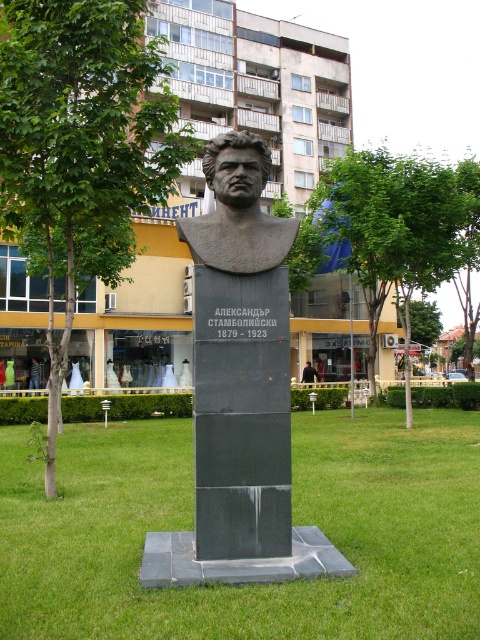
Question: In this image, where is green leafy tree at center located relative to matte black bust at center?

Choices:
 (A) left
 (B) right

Answer: (B)

Question: Which point is farther to the camera?

Choices:
 (A) (169, 141)
 (B) (266, 262)

Answer: (A)

Question: Which of the following is the farthest from the observer?

Choices:
 (A) slate gray stone bust at center
 (B) green grass at center
 (C) green leafy tree at center
 (D) green leafy tree at left

Answer: (C)

Question: In this image, where is green grass at center located relative to black leather jacket at center?

Choices:
 (A) below
 (B) above

Answer: (B)

Question: Where is green leafy tree at left located in relation to black granite bust at center in the image?

Choices:
 (A) above
 (B) below

Answer: (A)

Question: Which object is the farthest from the green grass at center?

Choices:
 (A) black granite bust at center
 (B) green leafy tree at left
 (C) green leafy tree at center
 (D) black leather jacket at center

Answer: (D)